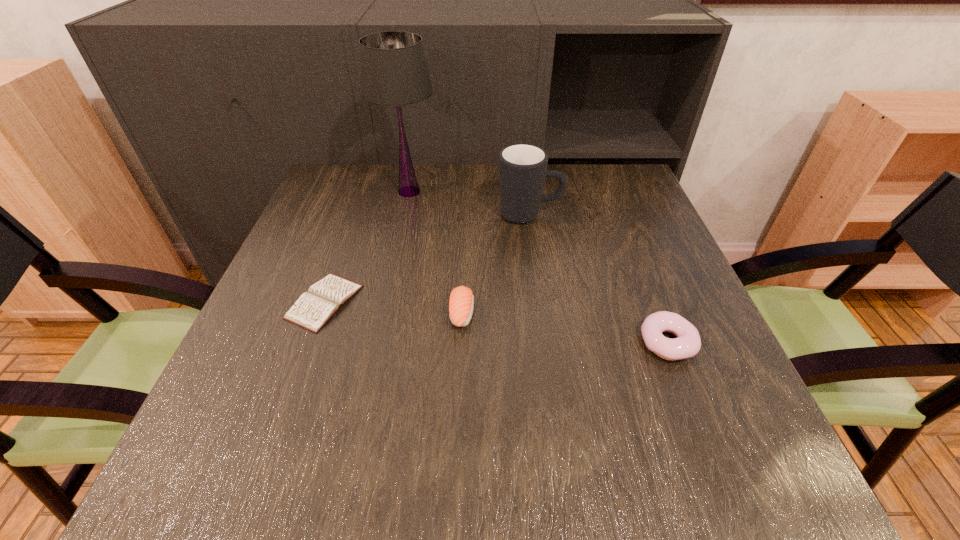
I want to click on lampshade, so click(393, 68).

Identify the location of the fourth shortest object. (522, 167).

Image resolution: width=960 pixels, height=540 pixels. I want to click on the second object from right to left, so click(x=522, y=167).

The width and height of the screenshot is (960, 540). Identify the location of the third shortest object. (461, 301).

The height and width of the screenshot is (540, 960). In order to click on the third object from right to left in this screenshot , I will do `click(461, 301)`.

At what (x,y) coordinates should I click in order to perform the action: click on the rightmost object. Please return your answer as a coordinate pair (x, y). This screenshot has width=960, height=540. Looking at the image, I should click on click(x=687, y=344).

Locate an element on the screen. the second shortest object is located at coordinates (x=687, y=344).

The height and width of the screenshot is (540, 960). Find the location of `diary`. diary is located at coordinates (314, 308).

This screenshot has width=960, height=540. I want to click on free spot located on the front-facing side of the lampshade, so click(390, 281).

This screenshot has width=960, height=540. I want to click on free space located on the side of the fourth shortest object with the handle, so click(644, 214).